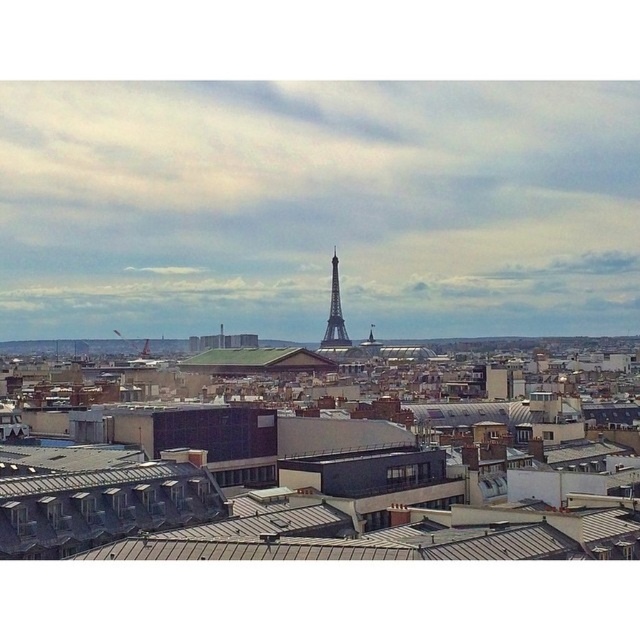
Who is shorter, gray metallic roof at center or shiny metallic eiffel tower at center?

With less height is gray metallic roof at center.

This screenshot has width=640, height=640. What do you see at coordinates (304, 497) in the screenshot?
I see `gray metallic roof at center` at bounding box center [304, 497].

Describe the element at coordinates (304, 497) in the screenshot. I see `gray metallic roof at center` at that location.

Identify the location of gray metallic roof at center. The height and width of the screenshot is (640, 640). (304, 497).